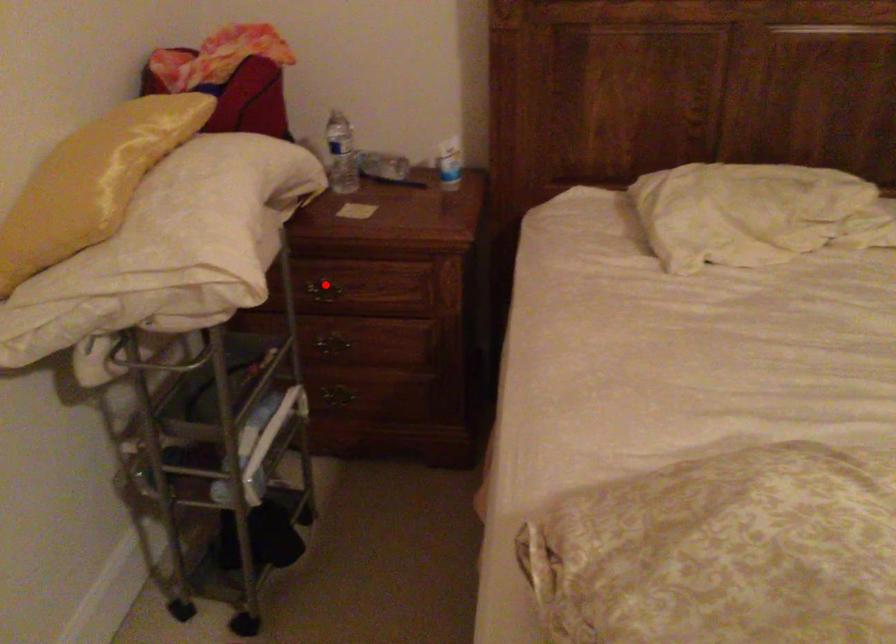
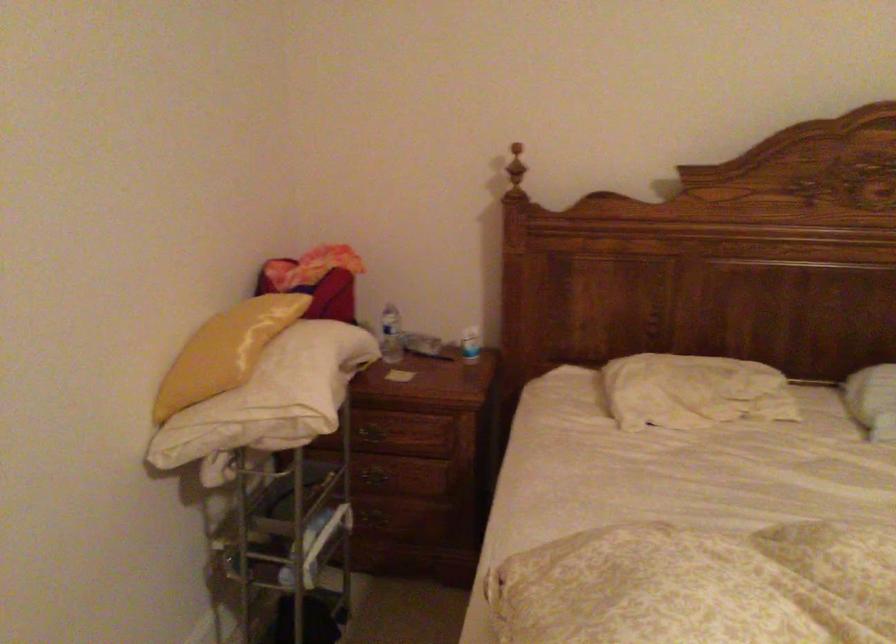
Where in the second image is the point corresponding to the highlighted location from the first image?

(374, 430)